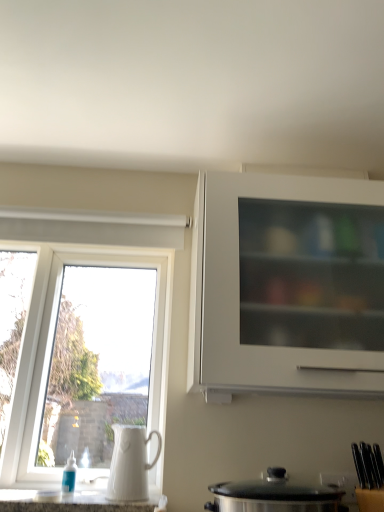
Question: Considering their positions, is white plastic window at left located in front of or behind white ceramic jug at left?

Choices:
 (A) behind
 (B) front

Answer: (A)

Question: Choose the correct answer: Is white plastic window at left inside white ceramic jug at left or outside it?

Choices:
 (A) inside
 (B) outside

Answer: (B)

Question: Which object is the closest to the white matte cabinet at upper right?

Choices:
 (A) white glossy countertop at lower center
 (B) stainless steel pot at lower center
 (C) white ceramic jug at left
 (D) white plastic window at left

Answer: (B)

Question: Which object is positioned closest to the white ceramic jug at left?

Choices:
 (A) white matte cabinet at upper right
 (B) stainless steel pot at lower center
 (C) white glossy countertop at lower center
 (D) white plastic window at left

Answer: (C)